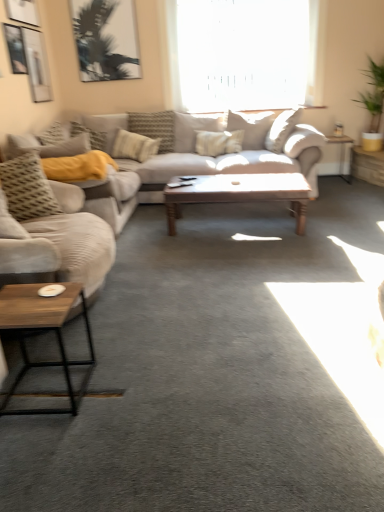
The width and height of the screenshot is (384, 512). In order to click on free point above wooden/metallic coffee table at lower left, the first coffee table viewed from the front (from a real-world perspective) in this screenshot , I will do `click(32, 301)`.